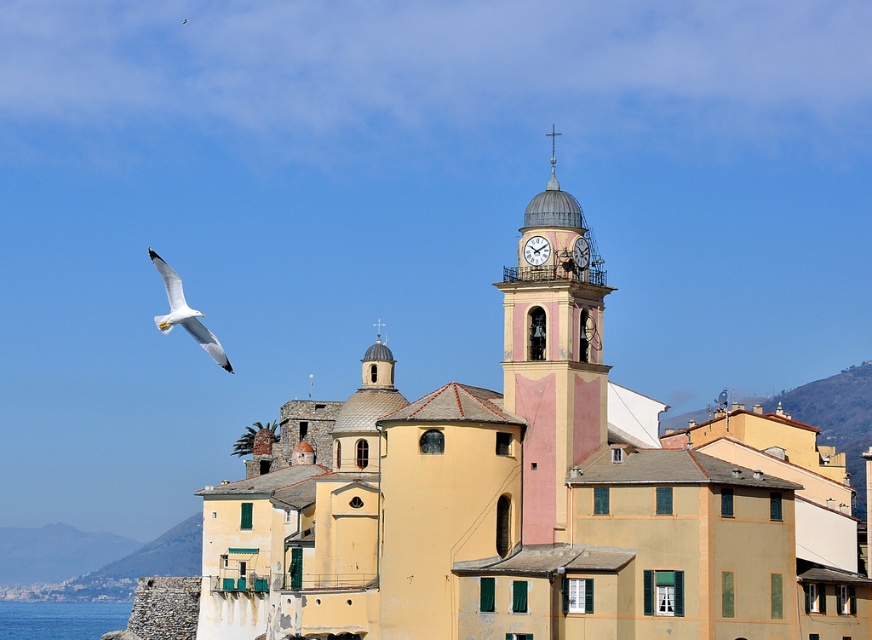
You are a tourist standing in the coastal town looking at the scene. You notice the pink painted stone clock tower at upper center and the white feathered bird at upper left. Which object is located higher in the image?

The pink painted stone clock tower at upper center is positioned over the white feathered bird at upper left, so it is higher in the image.

You are a tourist standing in the coastal town square. You notice the light yellow stucco church at center and the pink painted stone clock tower at upper center. Which structure has a greater width from your perspective?

The light yellow stucco church at center has a greater width than the pink painted stone clock tower at upper center from your perspective.